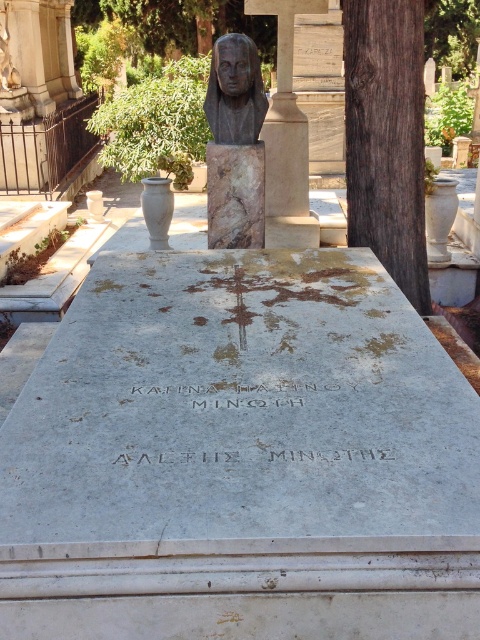
You are standing in front of the tombstone in the cemetery scene. There is a point marked at coordinates [386,138]. What is the color of the surface where this point is located?

The point [386,138] is on dark brown wood at right, so the surface color is dark brown.

In the scene shown: You are a visitor at the cemetery and want to place a flowerpot between the dark brown wood at right and the matte bronze bust at center. Can you estimate if there is enough space between them to fit a standard flowerpot that is 30 cm wide?

The dark brown wood at right might be wider than matte bronze bust at center, so there might be enough space between them to fit a standard flowerpot that is 30 cm wide.

You are a visitor at the cemetery and want to take a photo of the matte bronze bust at center and the dark brown wood at right. Based on their positions, which object should you frame first in your camera viewfinder to capture both in the same shot?

Since the dark brown wood at right is to the right of the matte bronze bust at center, you should frame the matte bronze bust at center first and then adjust to include the dark brown wood at right in the shot.